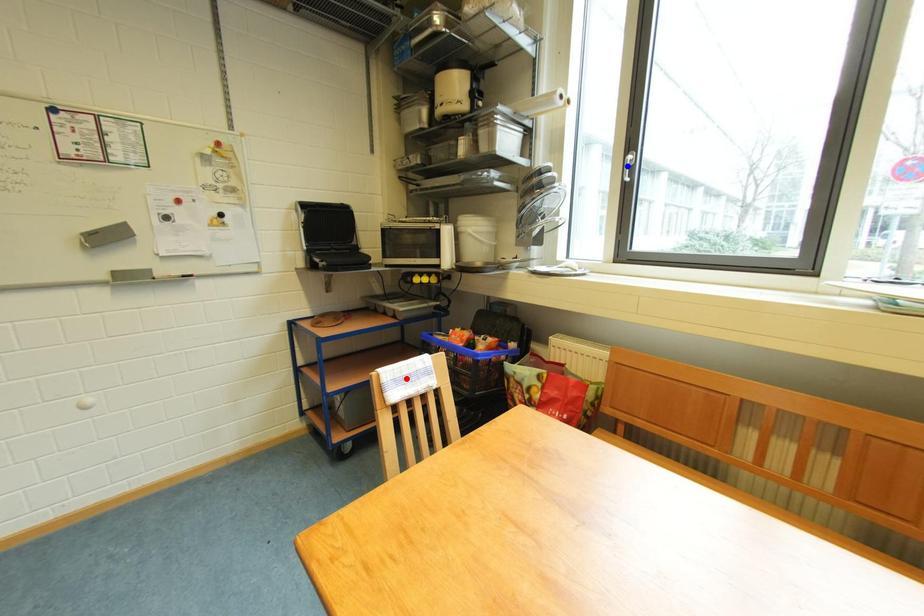
Question: In the image, two points are highlighted. Which point is nearer to the camera? Reply with the corresponding letter.

Choices:
 (A) blue point
 (B) red point

Answer: (B)